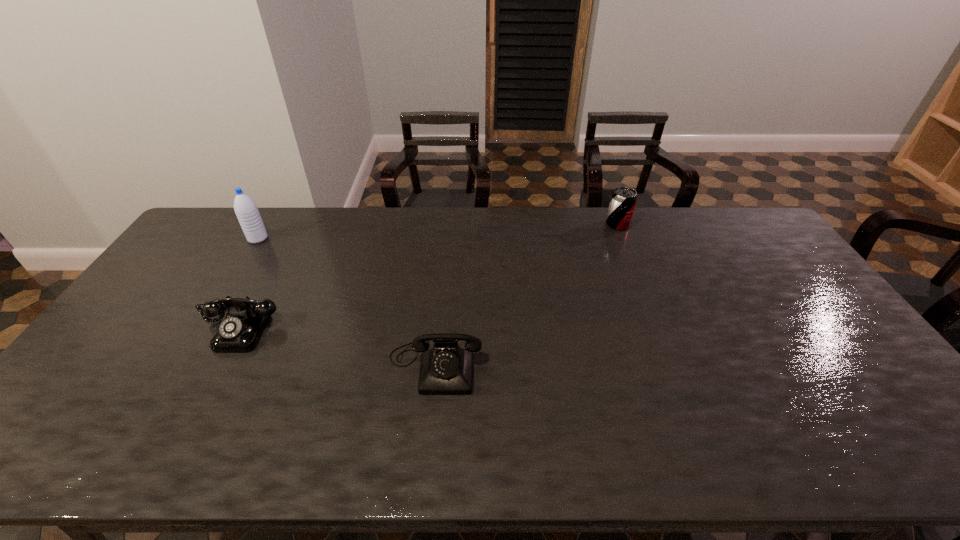
Locate an element on the screen. This screenshot has height=540, width=960. free space between the left telephone and the water bottle is located at coordinates (250, 284).

Find the location of a particular element. Image resolution: width=960 pixels, height=540 pixels. free area in between the rightmost object and the tallest object is located at coordinates (438, 232).

The image size is (960, 540). Find the location of `vacant space in between the left telephone and the soda can`. vacant space in between the left telephone and the soda can is located at coordinates (429, 276).

Locate an element on the screen. The image size is (960, 540). vacant area that lies between the left telephone and the tallest object is located at coordinates (250, 284).

Where is `blank region between the second object from right to left and the third shortest object`? blank region between the second object from right to left and the third shortest object is located at coordinates (526, 294).

You are a GUI agent. You are given a task and a screenshot of the screen. Output one action in this format:
    pyautogui.click(x=<x>, y=<y>)
    Task: Click on the object that stands as the second closest to the left telephone
    
    Given the screenshot: What is the action you would take?
    pyautogui.click(x=446, y=369)

Find the location of a particular element. This screenshot has height=540, width=960. the second closest object to the left telephone is located at coordinates (446, 369).

Where is `free space that satisfies the following two spatial constraints: 1. on the back side of the third nearest object; 2. on the left side of the farthest object`? Image resolution: width=960 pixels, height=540 pixels. free space that satisfies the following two spatial constraints: 1. on the back side of the third nearest object; 2. on the left side of the farthest object is located at coordinates (267, 225).

Locate an element on the screen. The image size is (960, 540). free spot that satisfies the following two spatial constraints: 1. on the back side of the third nearest object; 2. on the left side of the farthest object is located at coordinates (267, 225).